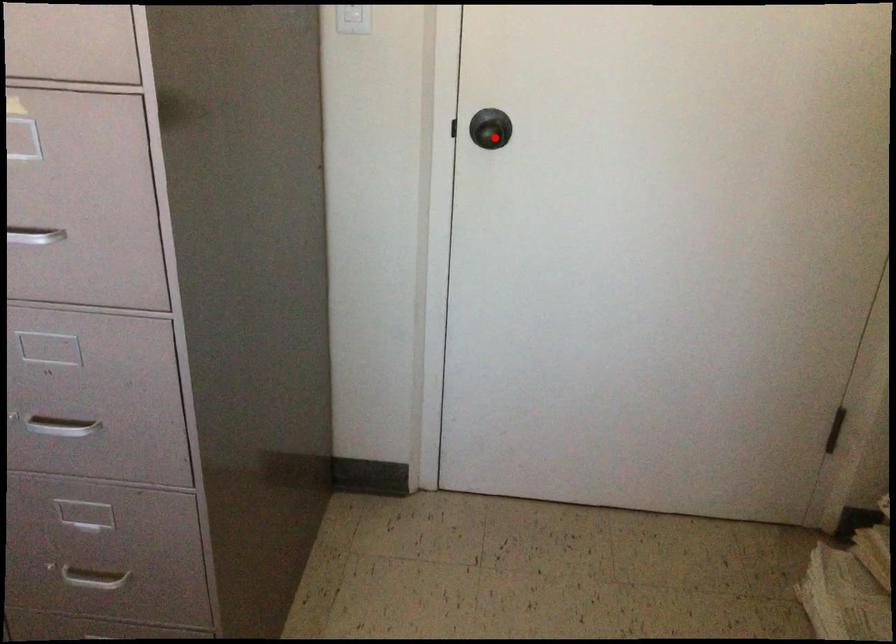
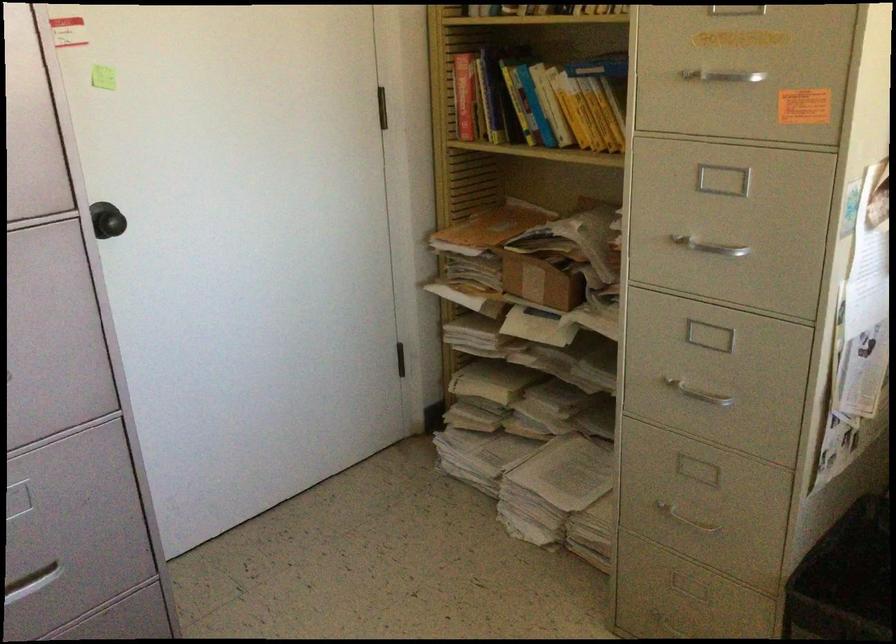
Question: I am providing you with two images of the same scene from different viewpoints. A red point is marked on the first image. Can you still see the location of the red point in image 2?

Choices:
 (A) Yes
 (B) No

Answer: (A)